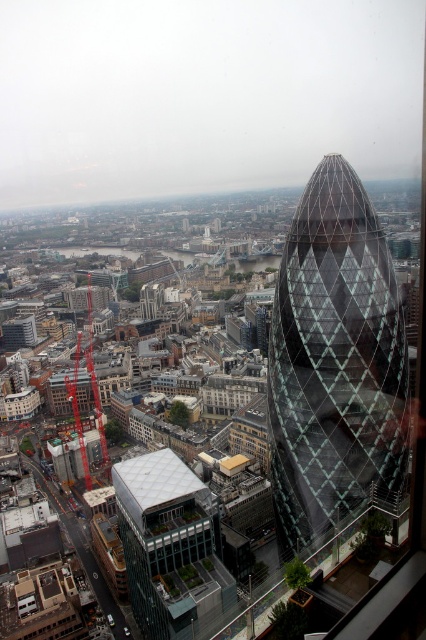
You are an architect observing the cityscape. You notice the transparent glass tower at center right and the clear glass windows at center. Which object appears nearer to you in the image?

The transparent glass tower at center right is closer to the viewer than the clear glass windows at center, so the transparent glass tower at center right appears nearer.

Looking at this image, you are a city planner assessing the construction site. You need to install a new communication tower that requires a clear line of sight between the transparent glass tower at center right and the clear glass windows at center. Given the current distance between them is 37.19 meters, what is the minimum height the new tower must be to ensure no obstruction?

The minimum height required for the new communication tower must be at least 37.19 meters to ensure a clear line of sight between the transparent glass tower at center right and the clear glass windows at center.

You are a tourist standing in the city square and see the transparent glass tower at center right and the clear glass windows at center. Which structure is positioned more to the east?

The transparent glass tower at center right is to the right of clear glass windows at center, so it is positioned more to the east.